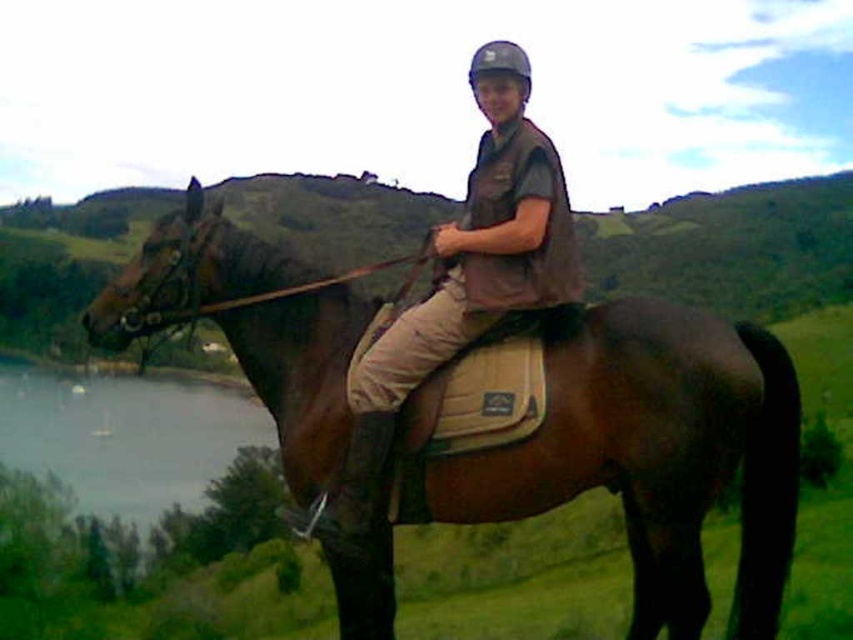
Can you confirm if brown leather vest at center is smaller than grayish water at lower left?

Indeed, brown leather vest at center has a smaller size compared to grayish water at lower left.

Is point (503, 177) closer to viewer compared to point (9, 444)?

Yes.

Where is `brown leather vest at center`? brown leather vest at center is located at coordinates (463, 278).

This screenshot has height=640, width=853. Describe the element at coordinates (647, 452) in the screenshot. I see `brown leather saddle at center` at that location.

Is brown leather saddle at center further to the viewer compared to brown leather vest at center?

No, brown leather saddle at center is closer to the viewer.

Does point (570, 417) lie in front of point (523, 218)?

Yes, point (570, 417) is in front of point (523, 218).

Locate an element on the screen. This screenshot has width=853, height=640. brown leather saddle at center is located at coordinates (647, 452).

Can you confirm if brown leather horse at center is wider than brown leather vest at center?

Correct, the width of brown leather horse at center exceeds that of brown leather vest at center.

Between brown leather horse at center and brown leather vest at center, which one appears on the right side from the viewer's perspective?

brown leather horse at center is more to the right.

Who is more distant from viewer, (59, 314) or (434, 339)?

Positioned behind is point (59, 314).

This screenshot has width=853, height=640. I want to click on brown leather horse at center, so click(732, 248).